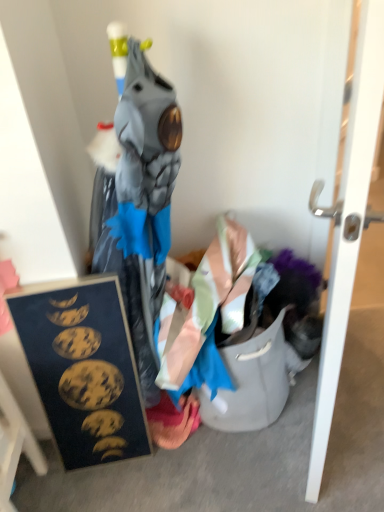
I want to click on vacant space in front of white glossy door at right, so click(x=332, y=457).